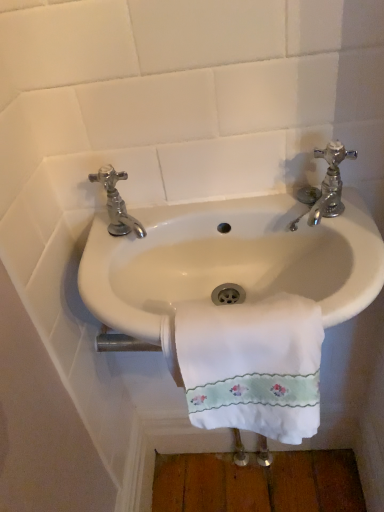
Question: Would you say white ceramic sink at center is a long distance from chrome metallic faucet at upper right, the 2th tap positioned from the left?

Choices:
 (A) yes
 (B) no

Answer: (B)

Question: Is white ceramic sink at center aimed at chrome metallic faucet at upper right, placed as the first tap when sorted from right to left?

Choices:
 (A) yes
 (B) no

Answer: (B)

Question: Is white ceramic sink at center to the left of chrome metallic faucet at upper right, the 2th tap positioned from the left, from the viewer's perspective?

Choices:
 (A) yes
 (B) no

Answer: (A)

Question: From a real-world perspective, does white ceramic sink at center stand above chrome metallic faucet at upper right, placed as the first tap when sorted from right to left?

Choices:
 (A) no
 (B) yes

Answer: (A)

Question: Considering the relative sizes of white ceramic sink at center and chrome metallic faucet at upper right, the 2th tap positioned from the left, in the image provided, is white ceramic sink at center bigger than chrome metallic faucet at upper right, the 2th tap positioned from the left,?

Choices:
 (A) no
 (B) yes

Answer: (B)

Question: Considering the relative positions of white embroidered towel at center and white ceramic sink at center in the image provided, is white embroidered towel at center to the left or to the right of white ceramic sink at center?

Choices:
 (A) right
 (B) left

Answer: (A)

Question: Looking at their shapes, would you say white embroidered towel at center is wider or thinner than white ceramic sink at center?

Choices:
 (A) thin
 (B) wide

Answer: (A)

Question: In terms of size, does white embroidered towel at center appear bigger or smaller than white ceramic sink at center?

Choices:
 (A) small
 (B) big

Answer: (A)

Question: Relative to white ceramic sink at center, is white embroidered towel at center in front or behind?

Choices:
 (A) behind
 (B) front

Answer: (B)

Question: Is point (89, 264) closer or farther from the camera than point (223, 418)?

Choices:
 (A) closer
 (B) farther

Answer: (B)

Question: Relative to white embroidered towel at center, is white ceramic sink at center in front or behind?

Choices:
 (A) behind
 (B) front

Answer: (A)

Question: Considering the positions of white ceramic sink at center and white embroidered towel at center in the image, is white ceramic sink at center wider or thinner than white embroidered towel at center?

Choices:
 (A) thin
 (B) wide

Answer: (B)

Question: Choose the correct answer: Is white ceramic sink at center inside white embroidered towel at center or outside it?

Choices:
 (A) inside
 (B) outside

Answer: (B)

Question: From the image's perspective, is chrome metallic faucet at upper right, placed as the first tap when sorted from right to left, above or below chrome metallic faucet at left, which is the 1th tap in left-to-right order?

Choices:
 (A) above
 (B) below

Answer: (A)

Question: From a real-world perspective, is chrome metallic faucet at upper right, placed as the first tap when sorted from right to left, above or below chrome metallic faucet at left, arranged as the 2th tap when viewed from the right?

Choices:
 (A) below
 (B) above

Answer: (A)